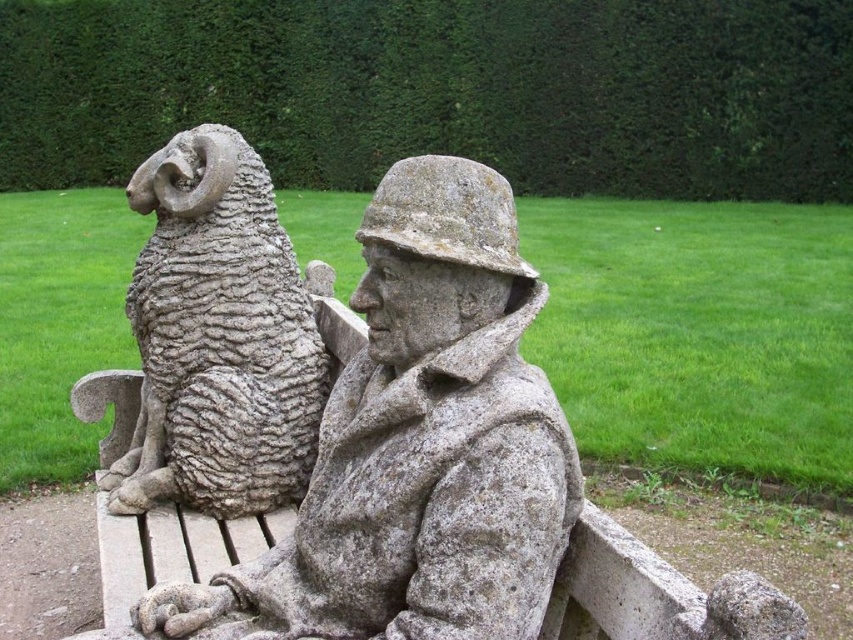
Is granite statue at center above gray stone ram at left?

Actually, granite statue at center is below gray stone ram at left.

Is granite statue at center positioned in front of gray stone ram at left?

Yes, granite statue at center is closer to the viewer.

The width and height of the screenshot is (853, 640). Find the location of `granite statue at center`. granite statue at center is located at coordinates (418, 445).